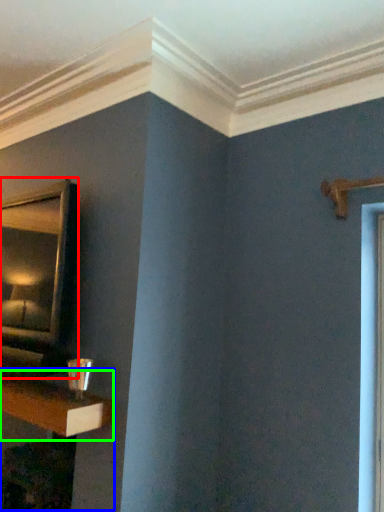
Question: Which object is the closest to the mirror (highlighted by a red box)? Choose among these: table (highlighted by a blue box) or shelf (highlighted by a green box).

Choices:
 (A) table
 (B) shelf

Answer: (B)